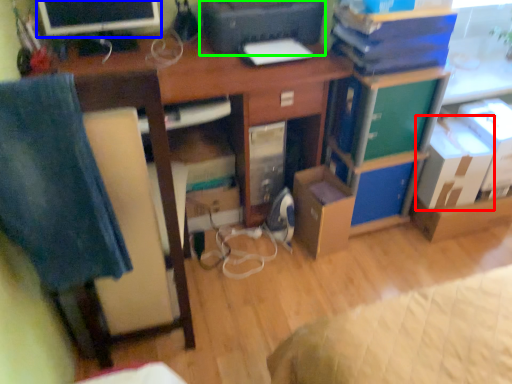
Question: Which object is the closest to the cardboard box (highlighted by a red box)? Choose among these: computer monitor (highlighted by a blue box) or printer (highlighted by a green box).

Choices:
 (A) computer monitor
 (B) printer

Answer: (B)